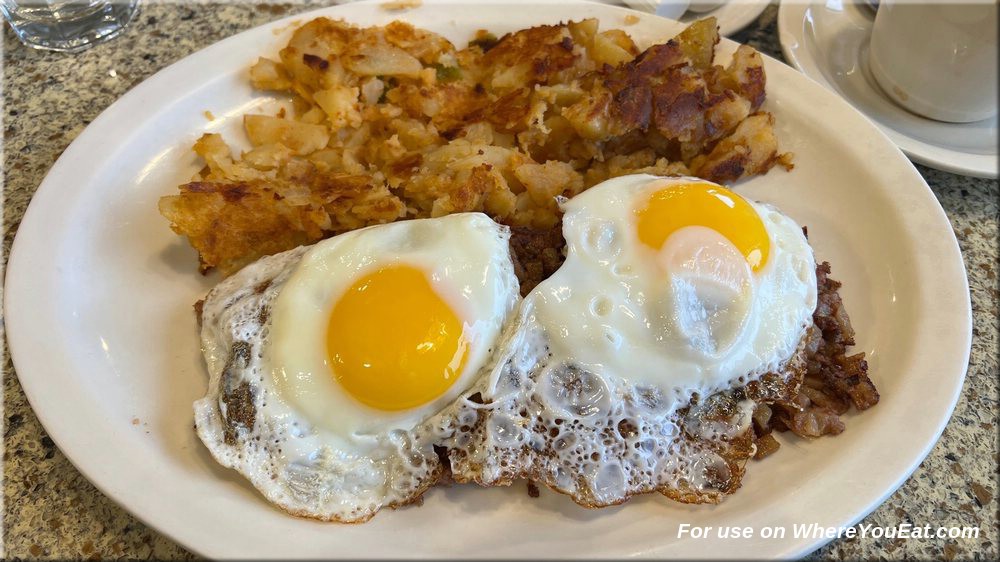
I want to click on white plate, so click(869, 478).